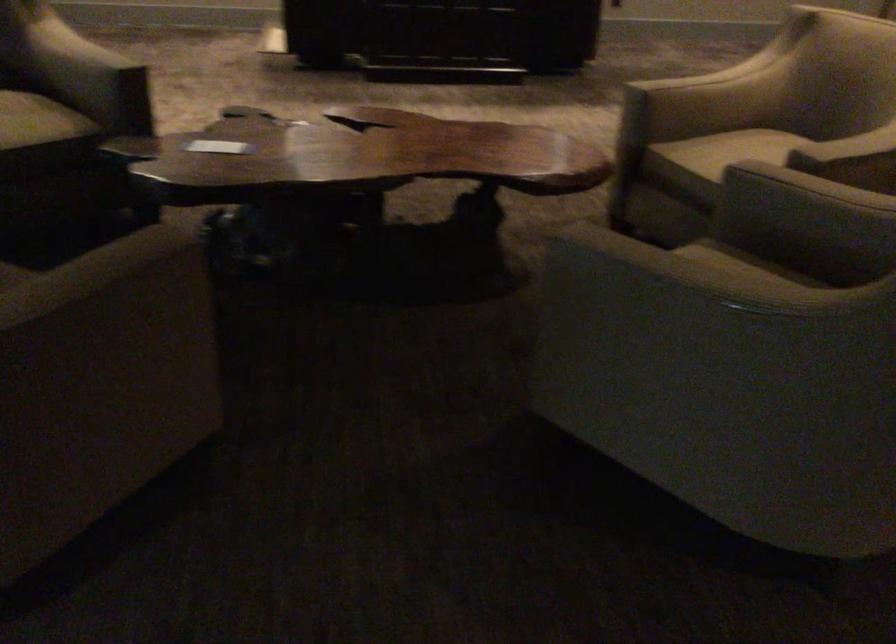
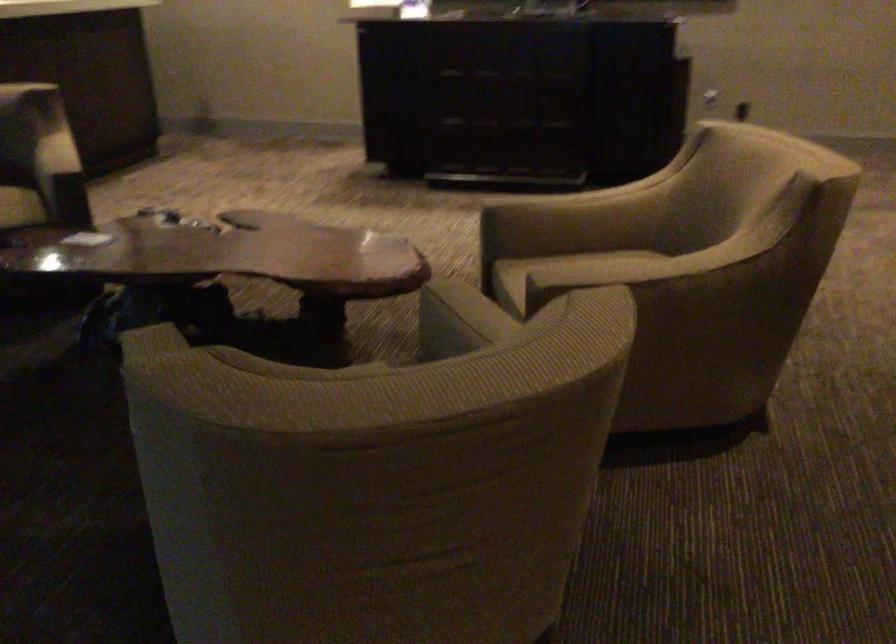
Question: The images are taken continuously from a first-person perspective. In which direction are you moving?

Choices:
 (A) Left
 (B) Right
 (C) Forward
 (D) Backward

Answer: (B)